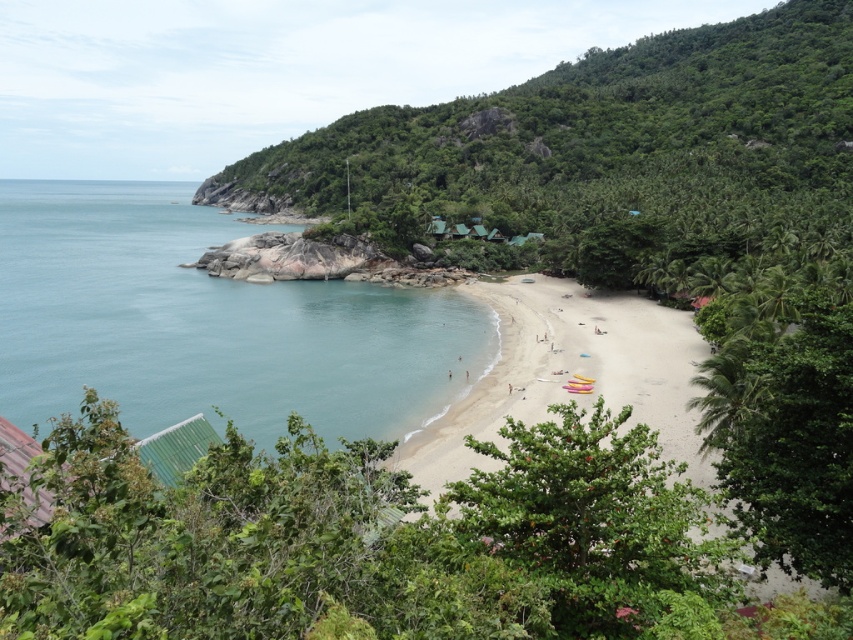
Question: Among these objects, which one is farthest from the camera?

Choices:
 (A) light brown sand at center
 (B) clear blue water at lower left
 (C) green leafy bush at center

Answer: (B)

Question: Considering the real-world distances, which object is closest to the clear blue water at lower left?

Choices:
 (A) green leafy bush at center
 (B) light brown sand at center

Answer: (B)

Question: Does green leafy bush at center lie behind light brown sand at center?

Choices:
 (A) yes
 (B) no

Answer: (B)

Question: Where is green leafy bush at center located in relation to clear blue water at lower left in the image?

Choices:
 (A) right
 (B) left

Answer: (A)

Question: Which of the following is the closest to the observer?

Choices:
 (A) (614, 595)
 (B) (544, 340)
 (C) (131, 193)

Answer: (A)

Question: Does green leafy bush at center come in front of clear blue water at lower left?

Choices:
 (A) no
 (B) yes

Answer: (B)